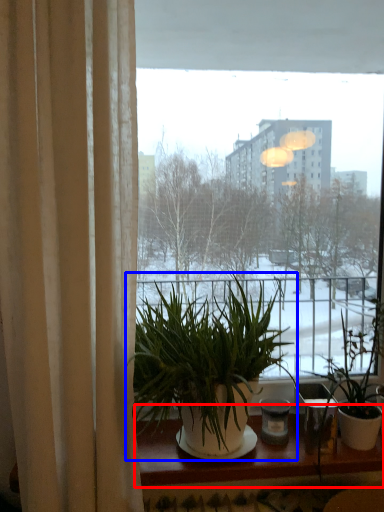
Question: Which object appears closest to the camera in this image, window sill (highlighted by a red box) or houseplant (highlighted by a blue box)?

Choices:
 (A) window sill
 (B) houseplant

Answer: (B)